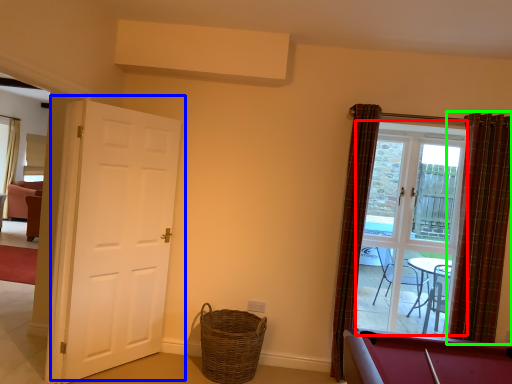
Question: Estimate the real-world distances between objects in this image. Which object is closer to glass door (highlighted by a red box), door (highlighted by a blue box) or curtain (highlighted by a green box)?

Choices:
 (A) door
 (B) curtain

Answer: (B)